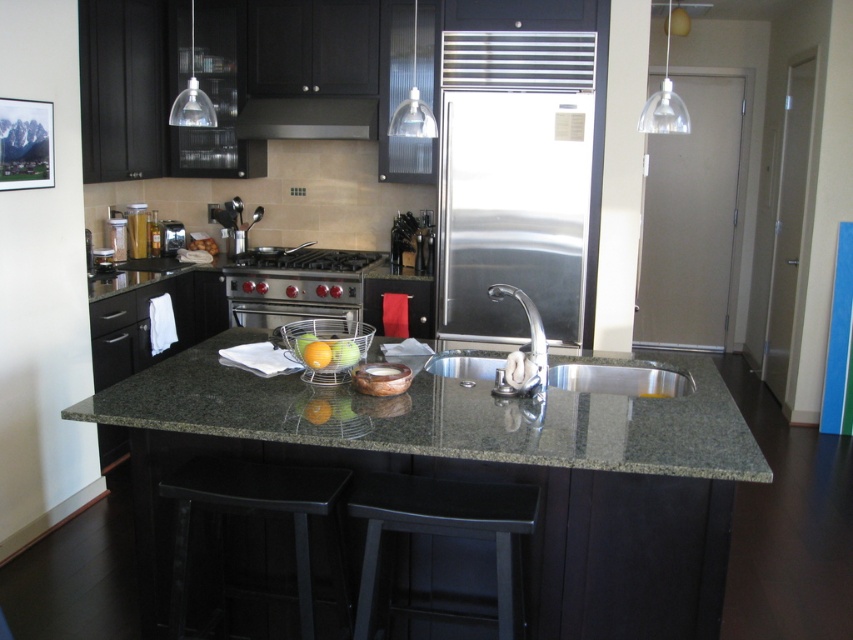
Is the position of black matte bar stool at lower center less distant than that of stainless steel stove at center?

Yes, black matte bar stool at lower center is in front of stainless steel stove at center.

Which of these two, black matte bar stool at lower center or stainless steel stove at center, stands taller?

Standing taller between the two is black matte bar stool at lower center.

Who is more distant from viewer, (x=366, y=637) or (x=325, y=257)?

The point (x=325, y=257) is more distant.

You are a GUI agent. You are given a task and a screenshot of the screen. Output one action in this format:
    pyautogui.click(x=<x>, y=<y>)
    Task: Click on the black matte bar stool at lower center
    This screenshot has width=853, height=640.
    Given the screenshot: What is the action you would take?
    pyautogui.click(x=445, y=529)

Between point (701, 460) and point (364, 483), which one is positioned behind?

Point (364, 483)

This screenshot has width=853, height=640. Describe the element at coordinates (444, 417) in the screenshot. I see `green granite countertop at center` at that location.

Is point (563, 397) farther from viewer compared to point (387, 483)?

Yes.

This screenshot has height=640, width=853. In order to click on green granite countertop at center in this screenshot , I will do pos(444,417).

Does black matte bar stool at lower center appear over black matte exhaust hood at upper center?

Incorrect, black matte bar stool at lower center is not positioned above black matte exhaust hood at upper center.

Consider the image. Which is more to the left, black matte bar stool at lower center or black matte exhaust hood at upper center?

black matte exhaust hood at upper center

Where is `black matte bar stool at lower center`? black matte bar stool at lower center is located at coordinates (445, 529).